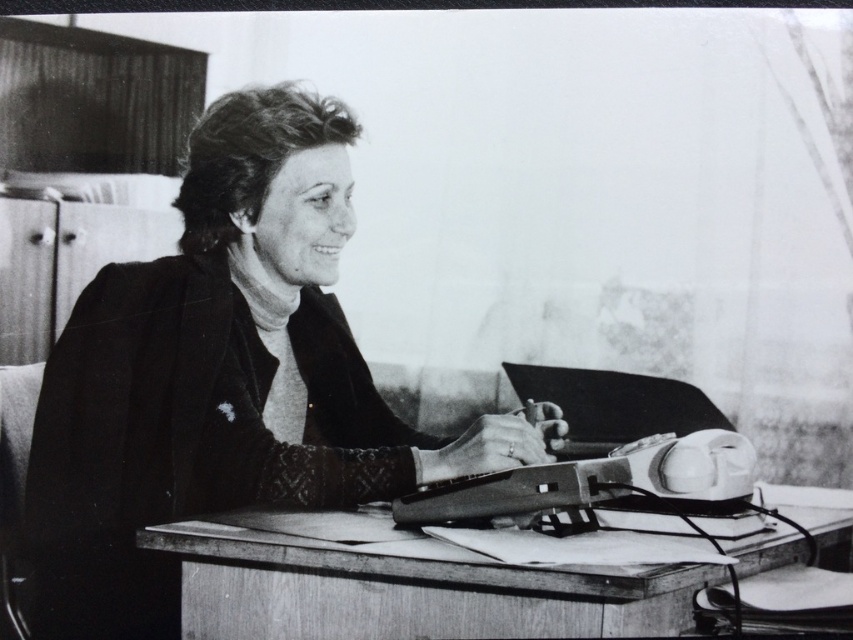
Question: Can you confirm if wooden table at center is positioned below shiny black laptop at center?

Choices:
 (A) no
 (B) yes

Answer: (B)

Question: From the image, what is the correct spatial relationship of smooth black sweater at center in relation to shiny black laptop at center?

Choices:
 (A) left
 (B) right

Answer: (A)

Question: Which of the following is the farthest from the observer?

Choices:
 (A) smooth black sweater at center
 (B) wooden table at center
 (C) shiny black laptop at center

Answer: (C)

Question: Which object is the farthest from the shiny black laptop at center?

Choices:
 (A) wooden table at center
 (B) smooth black sweater at center

Answer: (B)

Question: Is wooden table at center thinner than shiny black laptop at center?

Choices:
 (A) no
 (B) yes

Answer: (A)

Question: Which point appears farthest from the camera in this image?

Choices:
 (A) (686, 627)
 (B) (520, 364)
 (C) (213, 106)

Answer: (B)